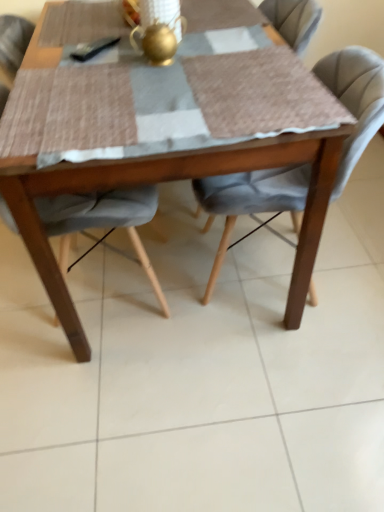
The width and height of the screenshot is (384, 512). Describe the element at coordinates (102, 222) in the screenshot. I see `velvet grey chair at center, marked as the first chair in a left-to-right arrangement` at that location.

How much space does velvet grey chair at center, positioned as the first chair in right-to-left order, occupy horizontally?

The width of velvet grey chair at center, positioned as the first chair in right-to-left order, is 21.32 inches.

The height and width of the screenshot is (512, 384). In order to click on velvet grey chair at center, marked as the first chair in a left-to-right arrangement in this screenshot , I will do `click(102, 222)`.

Relative to wooden table at center, is velvet grey chair at center, positioned as the second chair in left-to-right order, in front or behind?

velvet grey chair at center, positioned as the second chair in left-to-right order, is behind wooden table at center.

From the image's perspective, is velvet grey chair at center, positioned as the first chair in right-to-left order, on top of wooden table at center?

Incorrect, from the image's perspective, velvet grey chair at center, positioned as the first chair in right-to-left order, is lower than wooden table at center.

Would you say wooden table at center is part of velvet grey chair at center, positioned as the second chair in left-to-right order,'s contents?

Definitely not — wooden table at center is not inside velvet grey chair at center, positioned as the second chair in left-to-right order.

Between point (18, 19) and point (221, 201), which one is positioned in front?

Positioned in front is point (221, 201).

Between velvet grey chair at center, which ranks as the second chair in right-to-left order, and velvet grey chair at center, positioned as the first chair in right-to-left order, which one appears on the left side from the viewer's perspective?

Positioned to the left is velvet grey chair at center, which ranks as the second chair in right-to-left order.

Is velvet grey chair at center, marked as the first chair in a left-to-right arrangement, placed right next to velvet grey chair at center, positioned as the second chair in left-to-right order?

No, velvet grey chair at center, marked as the first chair in a left-to-right arrangement, is not with velvet grey chair at center, positioned as the second chair in left-to-right order.

Consider the image. From the image's perspective, is velvet grey chair at center, marked as the first chair in a left-to-right arrangement, under velvet grey chair at center, positioned as the first chair in right-to-left order?

Yes, from the image's perspective, velvet grey chair at center, marked as the first chair in a left-to-right arrangement, is below velvet grey chair at center, positioned as the first chair in right-to-left order.

Which point is more forward, (120,128) or (257,195)?

Point (120,128)

From a real-world perspective, which object rests below the other?

From a 3D spatial view, velvet grey chair at center, positioned as the second chair in left-to-right order, is below.

Does wooden table at center touch velvet grey chair at center, positioned as the first chair in right-to-left order?

No, wooden table at center is not with velvet grey chair at center, positioned as the first chair in right-to-left order.

From the image's perspective, which object appears higher, wooden table at center or velvet grey chair at center, positioned as the second chair in left-to-right order?

From the image's view, wooden table at center is above.

Do you think velvet grey chair at center, which ranks as the second chair in right-to-left order, is within wooden table at center, or outside of it?

velvet grey chair at center, which ranks as the second chair in right-to-left order, is contained in wooden table at center.

Is velvet grey chair at center, marked as the first chair in a left-to-right arrangement, to the left of wooden table at center from the viewer's perspective?

Correct, you'll find velvet grey chair at center, marked as the first chair in a left-to-right arrangement, to the left of wooden table at center.

Is point (26, 46) closer to viewer compared to point (324, 219)?

That is True.

Considering the points (170, 61) and (103, 215), which point is in front, point (170, 61) or point (103, 215)?

The point (103, 215) is closer to the camera.

Is gold metallic teapot at center positioned with its back to velvet grey chair at center, marked as the first chair in a left-to-right arrangement?

gold metallic teapot at center is not turned away from velvet grey chair at center, marked as the first chair in a left-to-right arrangement.

From the image's perspective, which is above, gold metallic teapot at center or velvet grey chair at center, marked as the first chair in a left-to-right arrangement?

From the image's view, gold metallic teapot at center is above.

Which point is more forward, (168, 41) or (367, 89)?

The point (367, 89) is closer.

Is gold metallic teapot at center taller than velvet grey chair at center, positioned as the first chair in right-to-left order?

No, gold metallic teapot at center is not taller than velvet grey chair at center, positioned as the first chair in right-to-left order.

Is velvet grey chair at center, positioned as the first chair in right-to-left order, at the back of gold metallic teapot at center?

No, gold metallic teapot at center's orientation is not away from velvet grey chair at center, positioned as the first chair in right-to-left order.

Consider the image. Is gold metallic teapot at center thinner than velvet grey chair at center, positioned as the second chair in left-to-right order?

Indeed, gold metallic teapot at center has a lesser width compared to velvet grey chair at center, positioned as the second chair in left-to-right order.

Does gold metallic teapot at center come behind wooden table at center?

Yes, it is behind wooden table at center.

The width and height of the screenshot is (384, 512). I want to click on kitchen & dining room table that appears below the gold metallic teapot at center (from the image's perspective), so click(x=159, y=154).

Considering the points (140, 30) and (164, 173), which point is in front, point (140, 30) or point (164, 173)?

The point (164, 173) is closer to the camera.

Find the location of a particular element. This screenshot has width=384, height=512. chair that is the 2nd one when counting backward from the wooden table at center is located at coordinates (250, 200).

Find the location of a particular element. The width and height of the screenshot is (384, 512). chair above the velvet grey chair at center, positioned as the second chair in left-to-right order (from a real-world perspective) is located at coordinates (102, 222).

Looking at the image, which one is located further to gold metallic teapot at center, velvet grey chair at center, which ranks as the second chair in right-to-left order, or wooden table at center?

Based on the image, velvet grey chair at center, which ranks as the second chair in right-to-left order, appears to be further to gold metallic teapot at center.

Estimate the real-world distances between objects in this image. Which object is closer to wooden table at center, velvet grey chair at center, positioned as the second chair in left-to-right order, or velvet grey chair at center, which ranks as the second chair in right-to-left order?

velvet grey chair at center, positioned as the second chair in left-to-right order.

Which object lies nearer to the anchor point velvet grey chair at center, marked as the first chair in a left-to-right arrangement, gold metallic teapot at center or velvet grey chair at center, positioned as the first chair in right-to-left order?

Among the two, velvet grey chair at center, positioned as the first chair in right-to-left order, is located nearer to velvet grey chair at center, marked as the first chair in a left-to-right arrangement.

Based on their spatial positions, is velvet grey chair at center, positioned as the second chair in left-to-right order, or wooden table at center closer to velvet grey chair at center, marked as the first chair in a left-to-right arrangement?

The object closer to velvet grey chair at center, marked as the first chair in a left-to-right arrangement, is wooden table at center.

Which object lies nearer to the anchor point wooden table at center, gold metallic teapot at center or velvet grey chair at center, positioned as the first chair in right-to-left order?

velvet grey chair at center, positioned as the first chair in right-to-left order, is closer to wooden table at center.

When comparing their distances from velvet grey chair at center, positioned as the second chair in left-to-right order, does wooden table at center or gold metallic teapot at center seem further?

The object further to velvet grey chair at center, positioned as the second chair in left-to-right order, is gold metallic teapot at center.

Based on their spatial positions, is velvet grey chair at center, positioned as the first chair in right-to-left order, or velvet grey chair at center, marked as the first chair in a left-to-right arrangement, closer to gold metallic teapot at center?

Based on the image, velvet grey chair at center, positioned as the first chair in right-to-left order, appears to be nearer to gold metallic teapot at center.

From the image, which object appears to be farther from velvet grey chair at center, positioned as the first chair in right-to-left order, gold metallic teapot at center or velvet grey chair at center, marked as the first chair in a left-to-right arrangement?

gold metallic teapot at center lies further to velvet grey chair at center, positioned as the first chair in right-to-left order, than the other object.

Find the location of a particular element. kitchen & dining room table situated between velvet grey chair at center, which ranks as the second chair in right-to-left order, and velvet grey chair at center, positioned as the second chair in left-to-right order, from left to right is located at coordinates (159, 154).

I want to click on kitchen & dining room table between gold metallic teapot at center and velvet grey chair at center, marked as the first chair in a left-to-right arrangement, in the vertical direction, so click(x=159, y=154).

Where is `tea pot situated between velvet grey chair at center, which ranks as the second chair in right-to-left order, and velvet grey chair at center, positioned as the first chair in right-to-left order, from left to right`? The width and height of the screenshot is (384, 512). tea pot situated between velvet grey chair at center, which ranks as the second chair in right-to-left order, and velvet grey chair at center, positioned as the first chair in right-to-left order, from left to right is located at coordinates (159, 40).

At what (x,y) coordinates should I click in order to perform the action: click on tea pot between wooden table at center and velvet grey chair at center, positioned as the second chair in left-to-right order, from left to right. Please return your answer as a coordinate pair (x, y). The image size is (384, 512). Looking at the image, I should click on (159, 40).